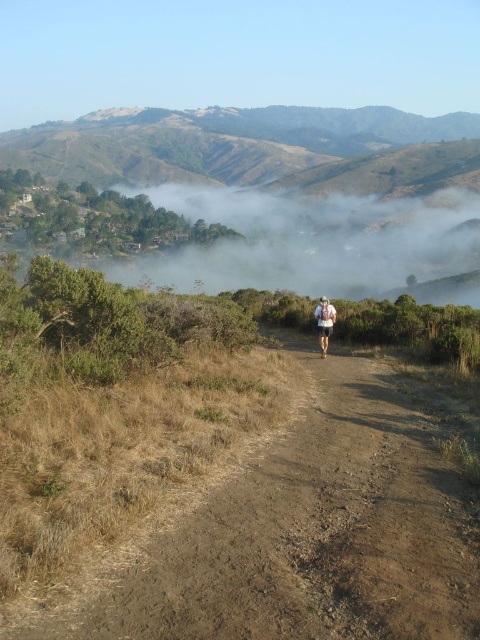
You are a hiker who just arrived at the scene. You see the brown dirt track at center and the white fabric at center. Which object is closer to you?

The brown dirt track at center is closer to you because it is in front of the white fabric at center.